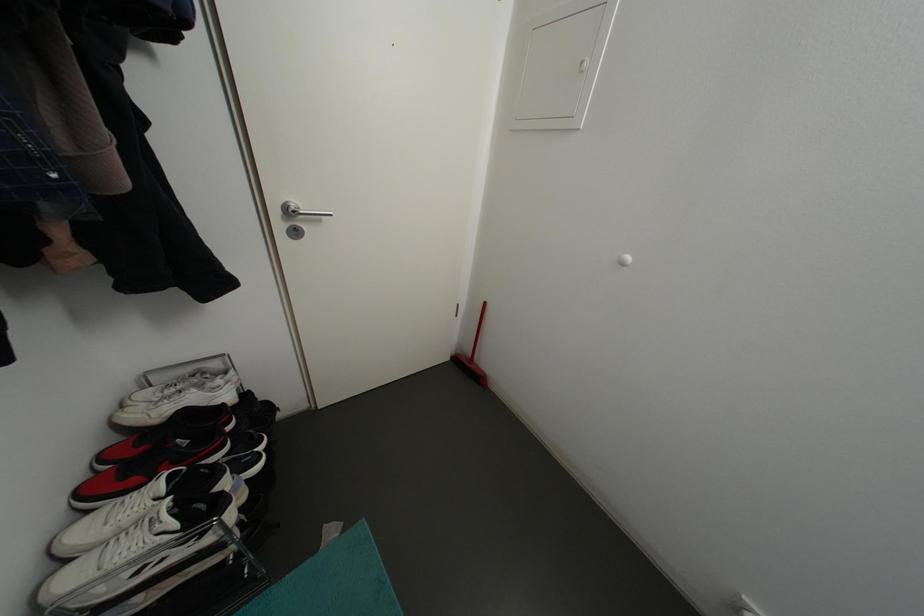
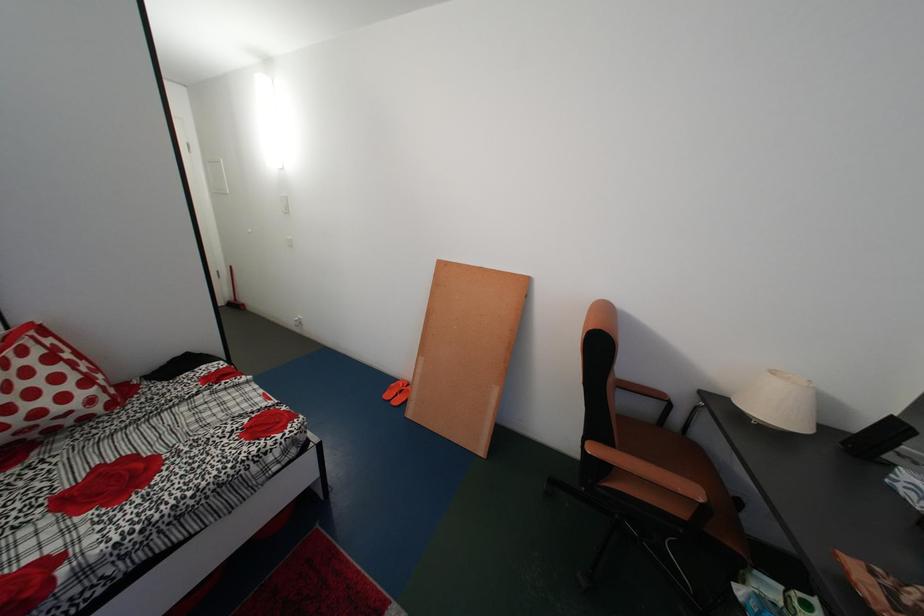
In a continuous first-person perspective shot, in which direction is the camera moving?

The movement direction of the cameraman is right, backward.